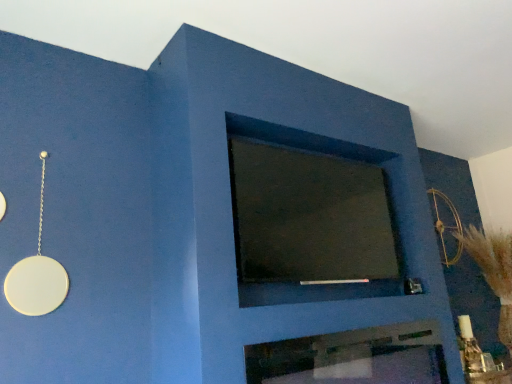
Identify the location of free spot above metallic silver fireplace at center (from a real-world perspective). (341, 324).